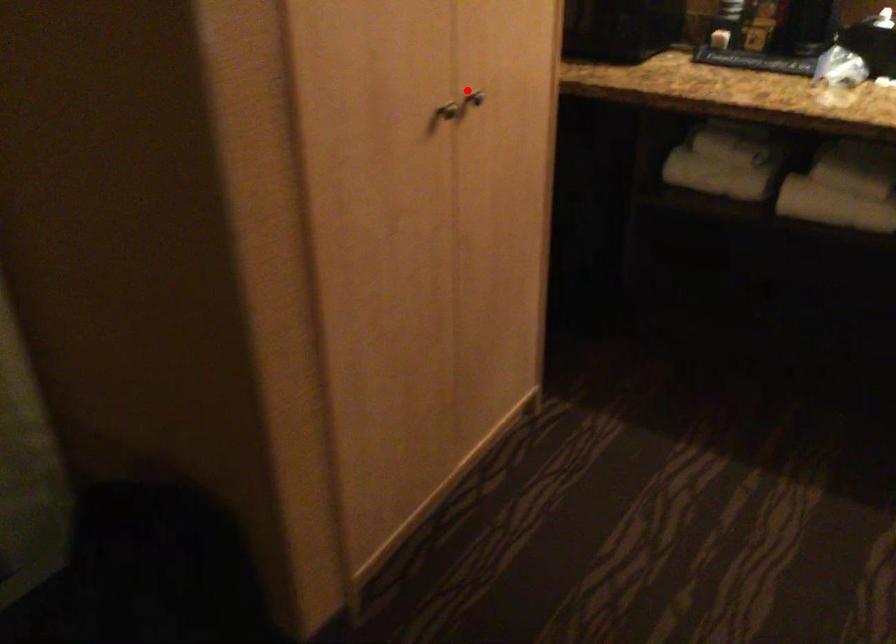
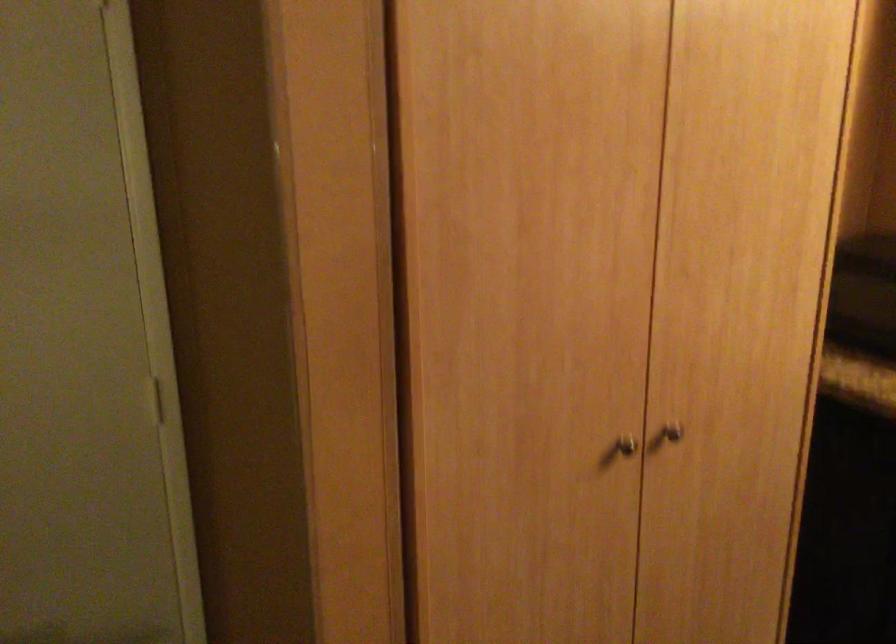
Locate, in the second image, the point that corresponds to the highlighted location in the first image.

(673, 431)